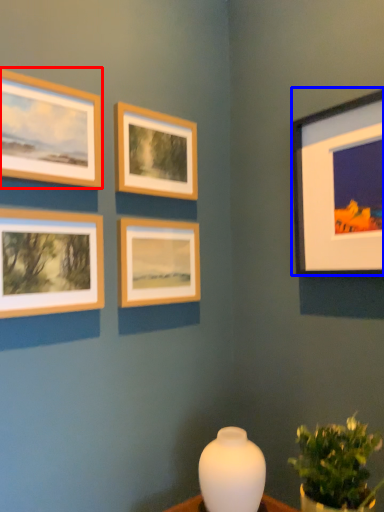
Question: Among these objects, which one is nearest to the camera, picture frame (highlighted by a red box) or picture frame (highlighted by a blue box)?

Choices:
 (A) picture frame
 (B) picture frame

Answer: (A)